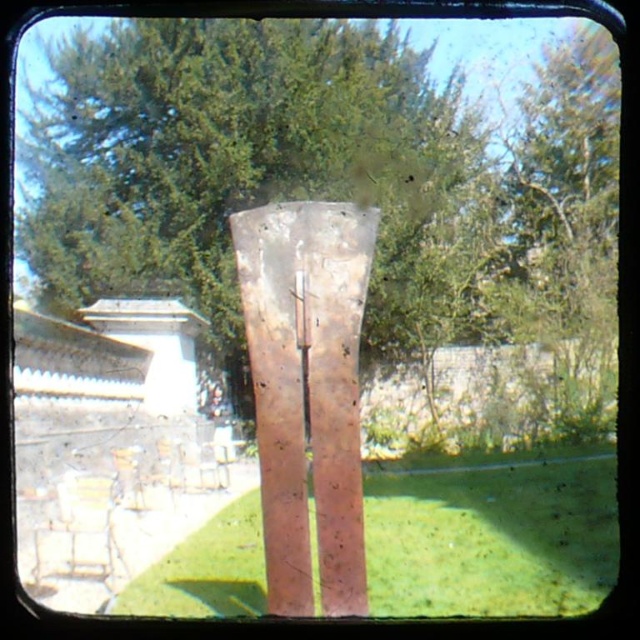
Locate an element on the screen. green grass at center is located at coordinates (492, 536).

Which is more to the left, green grass at center or rusty metal sculpture at center?

Positioned to the left is rusty metal sculpture at center.

Is point (577, 554) less distant than point (336, 566)?

No, (577, 554) is further to viewer.

This screenshot has height=640, width=640. What are the coordinates of `green grass at center` in the screenshot? It's located at (492, 536).